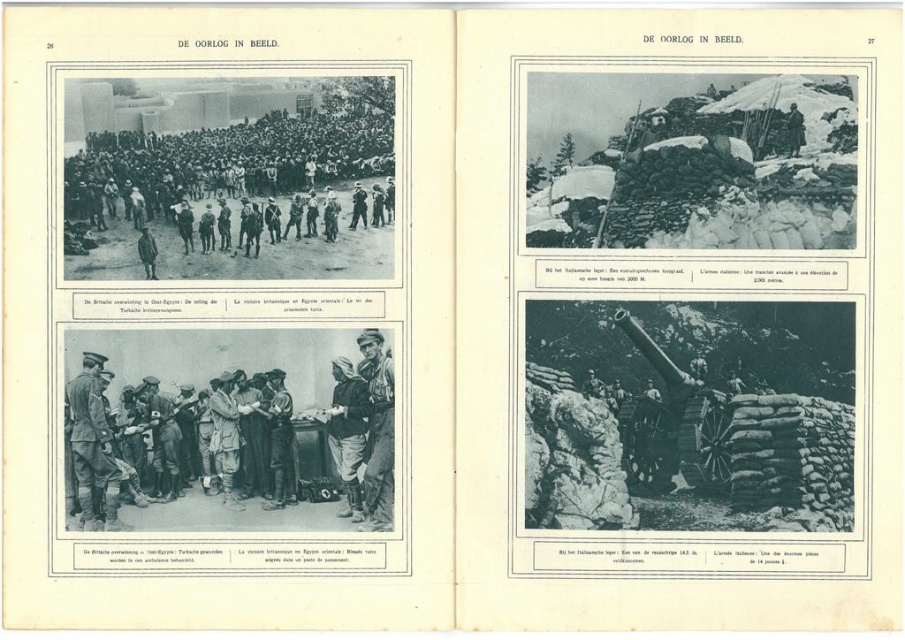
Question: Which is nearer to the camouflage fabric uniform at center?

Choices:
 (A) uniformed officer at center
 (B) dark gray uniform at upper center

Answer: (A)

Question: Which of the following is the closest to the observer?

Choices:
 (A) (354, 419)
 (B) (111, 522)
 (C) (805, 128)
 (D) (364, 356)

Answer: (A)

Question: Does uniformed officer at center appear over camouflage fabric uniform at center?

Choices:
 (A) no
 (B) yes

Answer: (A)

Question: Is uniformed officer at center closer to the viewer compared to camouflage fabric uniform at center?

Choices:
 (A) yes
 (B) no

Answer: (B)

Question: Which of the following is the closest to the observer?

Choices:
 (A) uniformed officer at center
 (B) camouflage fabric soldier at center
 (C) dark gray uniform at upper center
 (D) camouflage fabric uniform at center

Answer: (D)

Question: Can you confirm if uniformed officer at center is wider than camouflage fabric uniform at center?

Choices:
 (A) yes
 (B) no

Answer: (A)